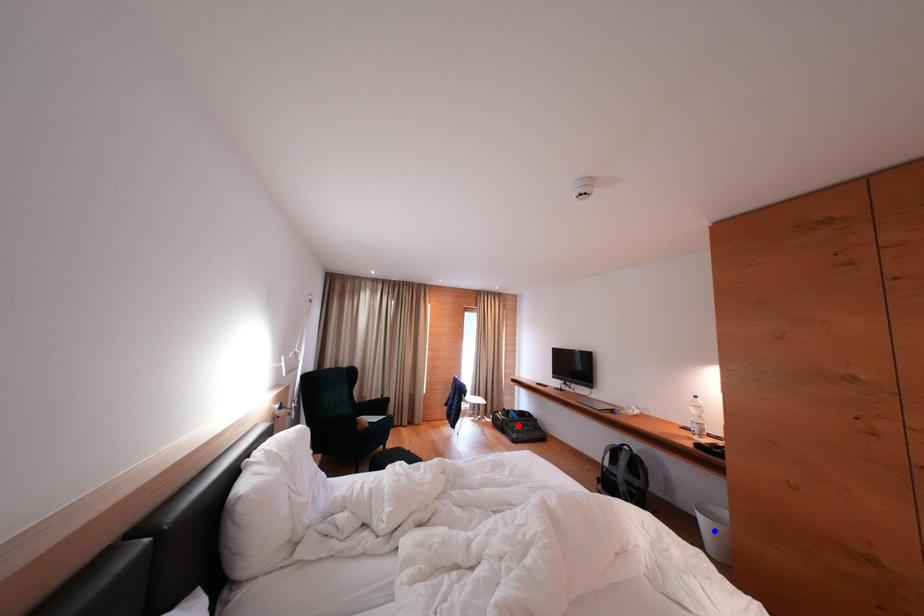
Question: Which of the two points in the image is closer to the camera?

Choices:
 (A) Blue point is closer.
 (B) Red point is closer.

Answer: (A)